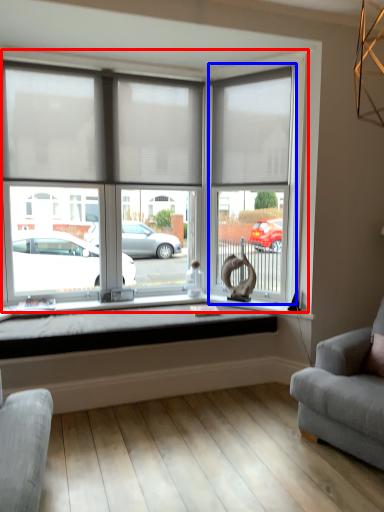
Question: Which of the following is the farthest to the observer, window (highlighted by a red box) or glass door (highlighted by a blue box)?

Choices:
 (A) window
 (B) glass door

Answer: (B)